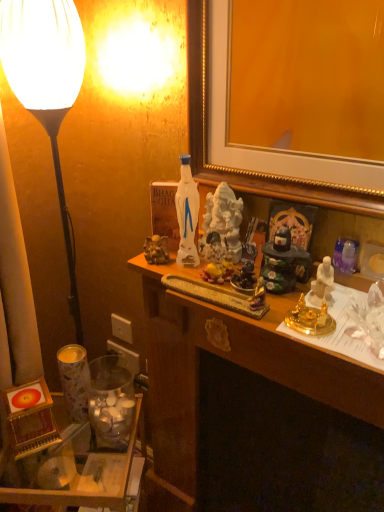
Question: From the image's perspective, would you say beige plastic power outlet at lower left, which appears as the first power outlet when viewed from the top, is positioned over wooden desk at center?

Choices:
 (A) no
 (B) yes

Answer: (B)

Question: Considering the relative positions of beige plastic power outlet at lower left, which is the 2th power outlet from bottom to top, and wooden desk at center in the image provided, is beige plastic power outlet at lower left, which is the 2th power outlet from bottom to top, to the left of wooden desk at center from the viewer's perspective?

Choices:
 (A) no
 (B) yes

Answer: (B)

Question: Can you confirm if beige plastic power outlet at lower left, which appears as the first power outlet when viewed from the top, is smaller than wooden desk at center?

Choices:
 (A) no
 (B) yes

Answer: (B)

Question: Is beige plastic power outlet at lower left, which appears as the first power outlet when viewed from the top, to the right of wooden desk at center from the viewer's perspective?

Choices:
 (A) yes
 (B) no

Answer: (B)

Question: From a real-world perspective, is beige plastic power outlet at lower left, which is the 2th power outlet from bottom to top, physically below wooden desk at center?

Choices:
 (A) no
 (B) yes

Answer: (A)

Question: Is beige plastic power outlet at lower left, which is the 2th power outlet from bottom to top, thinner than wooden desk at center?

Choices:
 (A) no
 (B) yes

Answer: (B)

Question: Considering the relative sizes of translucent glass jar at lower left and white plastic power outlet at lower left, the first power outlet positioned from the bottom, in the image provided, is translucent glass jar at lower left wider than white plastic power outlet at lower left, the first power outlet positioned from the bottom,?

Choices:
 (A) yes
 (B) no

Answer: (A)

Question: Considering the relative sizes of translucent glass jar at lower left and white plastic power outlet at lower left, the first power outlet positioned from the bottom, in the image provided, is translucent glass jar at lower left thinner than white plastic power outlet at lower left, the first power outlet positioned from the bottom,?

Choices:
 (A) no
 (B) yes

Answer: (A)

Question: Does translucent glass jar at lower left have a smaller size compared to white plastic power outlet at lower left, arranged as the 2th power outlet when viewed from the top?

Choices:
 (A) no
 (B) yes

Answer: (A)

Question: Could you tell me if translucent glass jar at lower left is turned towards white plastic power outlet at lower left, the first power outlet positioned from the bottom?

Choices:
 (A) yes
 (B) no

Answer: (B)

Question: Is the depth of translucent glass jar at lower left less than that of white plastic power outlet at lower left, arranged as the 2th power outlet when viewed from the top?

Choices:
 (A) no
 (B) yes

Answer: (B)

Question: Is translucent glass jar at lower left not close to white plastic power outlet at lower left, arranged as the 2th power outlet when viewed from the top?

Choices:
 (A) yes
 (B) no

Answer: (B)

Question: Is there a large distance between white matte lamp at left and translucent glass jar at lower left?

Choices:
 (A) yes
 (B) no

Answer: (B)